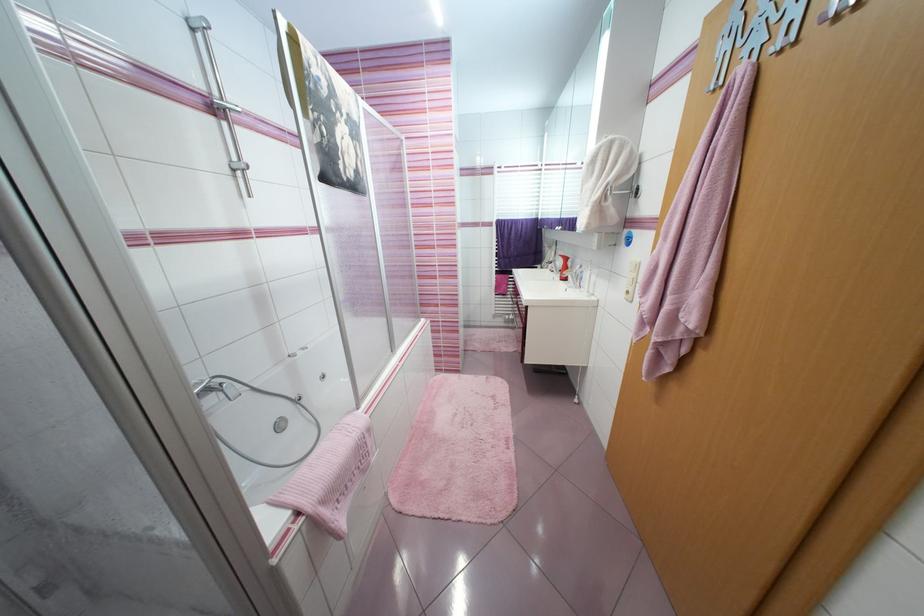
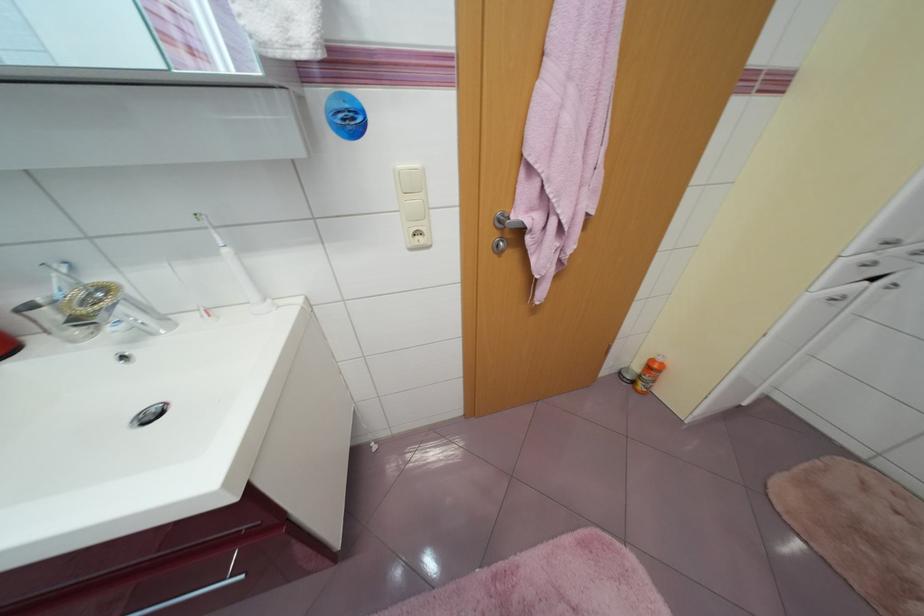
Where in the second image is the point corresponding to pixel 593 293 from the first image?

(270, 302)